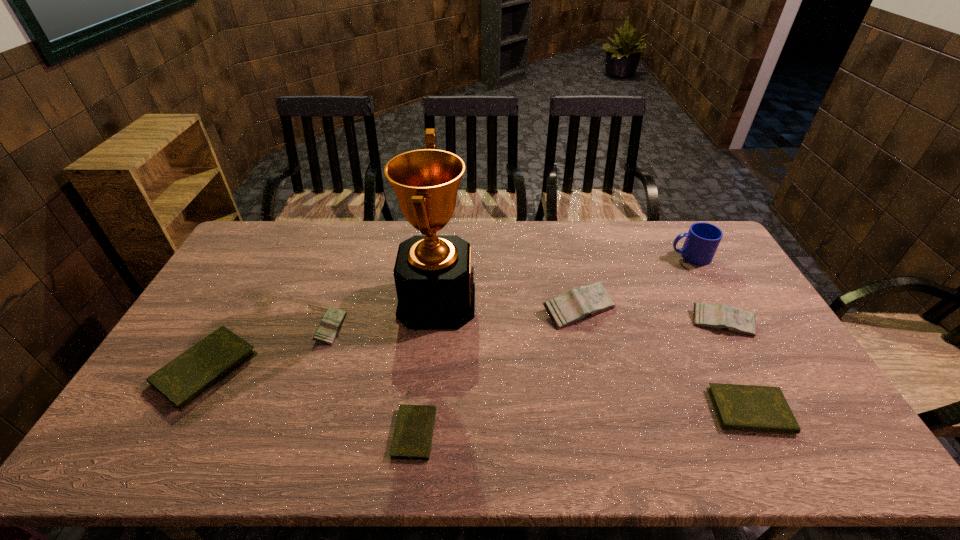
Locate an element on the screen. gold trophy cup is located at coordinates (434, 279).

You are a GUI agent. You are given a task and a screenshot of the screen. Output one action in this format:
    pyautogui.click(x=<x>, y=<y>)
    Task: Click on the trophy cup
    The height and width of the screenshot is (540, 960).
    Given the screenshot: What is the action you would take?
    pyautogui.click(x=434, y=279)

Identify the location of mug. The width and height of the screenshot is (960, 540). (702, 240).

Locate an element on the screen. blue mug is located at coordinates (702, 240).

Identify the location of the fourth object from right to left. (578, 304).

Image resolution: width=960 pixels, height=540 pixels. In order to click on the sixth shortest object in this screenshot , I will do `click(578, 304)`.

Find the location of `the fourth tallest object`. the fourth tallest object is located at coordinates (716, 316).

This screenshot has height=540, width=960. In order to click on the fifth shortest diary in this screenshot , I will do `click(716, 316)`.

This screenshot has height=540, width=960. I want to click on the fifth tallest object, so click(332, 320).

Image resolution: width=960 pixels, height=540 pixels. What are the coordinates of `the leftmost pink diary` in the screenshot? It's located at (332, 320).